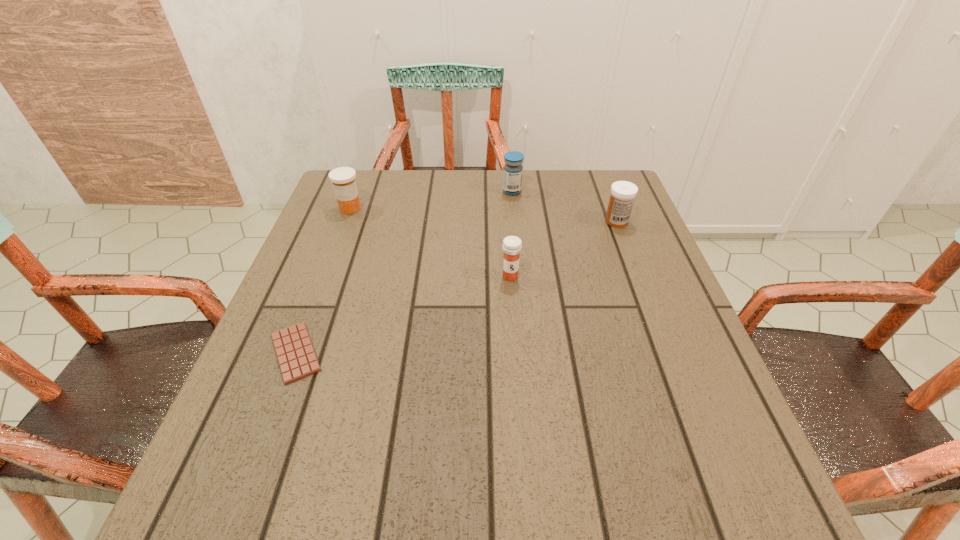
This screenshot has height=540, width=960. In the image, there is a desktop. What are the coordinates of `vacant space at the near left corner` in the screenshot? It's located at (266, 513).

Identify the location of free space at the far right corner of the desktop. (598, 198).

The width and height of the screenshot is (960, 540). Identify the location of vacant area at the near right corner of the desktop. (688, 483).

Identify the location of free space between the rightmost medicine and the second nearest object. The width and height of the screenshot is (960, 540). (564, 249).

The height and width of the screenshot is (540, 960). Find the location of `free spot between the nearest object and the second nearest object`. free spot between the nearest object and the second nearest object is located at coordinates (403, 314).

Image resolution: width=960 pixels, height=540 pixels. I want to click on free space between the leftmost medicine and the nearest object, so click(323, 280).

This screenshot has width=960, height=540. I want to click on vacant area that lies between the shortest object and the farthest object, so click(404, 272).

Locate an element on the screen. The height and width of the screenshot is (540, 960). vacant point located between the leftmost medicine and the rightmost object is located at coordinates (483, 215).

Identify the location of unoccupied area between the rightmost medicine and the shortest object. The width and height of the screenshot is (960, 540). (456, 287).

The width and height of the screenshot is (960, 540). What are the coordinates of `free spot between the nearest object and the farthest medicine` in the screenshot? It's located at (404, 272).